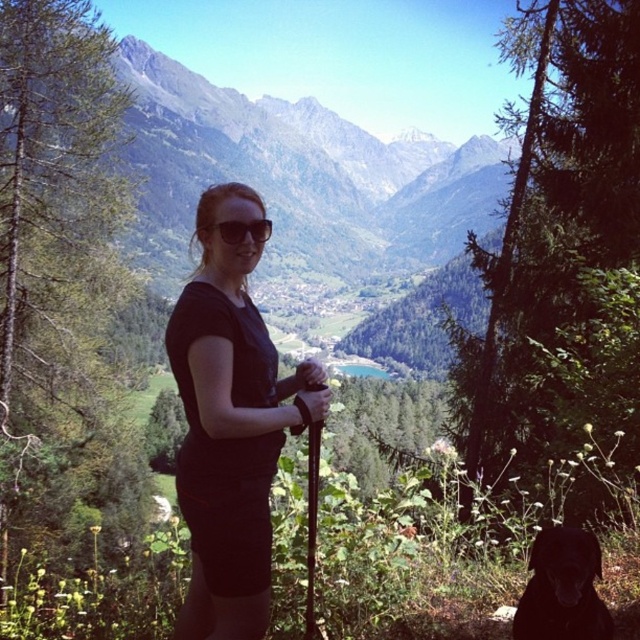
Question: Is green forested mountain at center in front of black matte shirt at center?

Choices:
 (A) yes
 (B) no

Answer: (B)

Question: Which point is farther to the camera?

Choices:
 (A) green forested mountain at center
 (B) black matte dog at lower right
 (C) matte black sunglasses at center
 (D) black rubber ski pole at center

Answer: (A)

Question: Is green forested mountain at center to the right of black matte shirt at center from the viewer's perspective?

Choices:
 (A) yes
 (B) no

Answer: (B)

Question: Which point is farther to the camera?

Choices:
 (A) (221, 164)
 (B) (595, 566)

Answer: (A)

Question: Estimate the real-world distances between objects in this image. Which object is farther from the matte black sunglasses at center?

Choices:
 (A) black matte dog at lower right
 (B) black matte shirt at center
 (C) black rubber ski pole at center

Answer: (A)

Question: Is green forested mountain at center positioned behind black matte shirt at center?

Choices:
 (A) no
 (B) yes

Answer: (B)